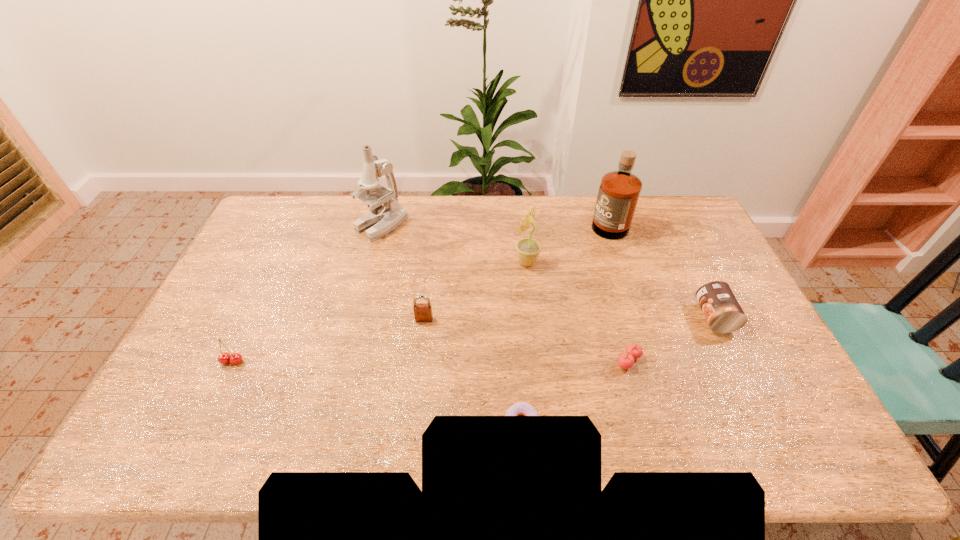
What are the coordinates of `the shortest object` in the screenshot? It's located at (521, 408).

Where is `vacant region located 0.170m on the front of the seventh object from right to left`? vacant region located 0.170m on the front of the seventh object from right to left is located at coordinates (369, 276).

Find the location of a particular element. This screenshot has height=540, width=960. vacant space located 0.300m on the front label of the liquor is located at coordinates (508, 220).

At what (x,y) coordinates should I click in order to perform the action: click on free spot located 0.130m on the front label of the liquor. Please return your answer as a coordinate pair (x, y). Looking at the image, I should click on (554, 220).

You are a GUI agent. You are given a task and a screenshot of the screen. Output one action in this format:
    pyautogui.click(x=<x>, y=<y>)
    Task: Click on the vacant space located on the front label of the liquor
    This screenshot has width=960, height=540.
    Given the screenshot: What is the action you would take?
    pyautogui.click(x=500, y=220)

This screenshot has width=960, height=540. I want to click on free point located 0.400m on the face of the sunflower, so click(x=394, y=262).

In order to click on free point located on the face of the sunflower in this screenshot , I will do `click(439, 262)`.

I want to click on free space located 0.160m on the face of the sunflower, so click(466, 262).

You are a GUI agent. You are given a task and a screenshot of the screen. Output one action in this format:
    pyautogui.click(x=<x>, y=<y>)
    Task: Click on the vacant position located 0.100m on the front-facing side of the padlock
    
    Given the screenshot: What is the action you would take?
    pyautogui.click(x=420, y=350)

Find the location of a particular element. The height and width of the screenshot is (540, 960). vacant region located 0.370m on the front label of the can is located at coordinates (573, 318).